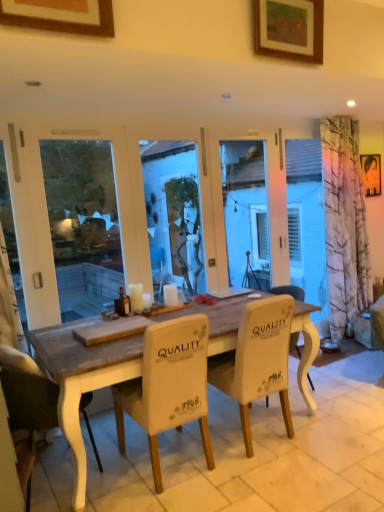
Question: From a real-world perspective, is wooden picture frame at upper center, which is the 3th picture frame in back-to-front order, beneath white fabric chair at center, the third chair viewed from the left?

Choices:
 (A) yes
 (B) no

Answer: (B)

Question: Is white fabric chair at center, the third chair viewed from the left, inside wooden picture frame at upper center, which is the 3th picture frame in back-to-front order?

Choices:
 (A) no
 (B) yes

Answer: (A)

Question: Considering the relative positions of wooden picture frame at upper center, which is the 3th picture frame in back-to-front order, and white fabric chair at center, the third chair viewed from the left, in the image provided, is wooden picture frame at upper center, which is the 3th picture frame in back-to-front order, behind white fabric chair at center, the third chair viewed from the left,?

Choices:
 (A) yes
 (B) no

Answer: (B)

Question: Considering the relative positions of wooden picture frame at upper center, which is counted as the third picture frame, starting from the right, and white fabric chair at center, the third chair viewed from the left, in the image provided, is wooden picture frame at upper center, which is counted as the third picture frame, starting from the right, to the right of white fabric chair at center, the third chair viewed from the left, from the viewer's perspective?

Choices:
 (A) yes
 (B) no

Answer: (B)

Question: From a real-world perspective, is wooden picture frame at upper center, which ranks as the first picture frame in front-to-back order, over white fabric chair at center, which is the first chair in right-to-left order?

Choices:
 (A) no
 (B) yes

Answer: (B)

Question: Is wooden picture frame at upper center, which is counted as the third picture frame, starting from the right, bigger than white fabric chair at center, the third chair viewed from the left?

Choices:
 (A) yes
 (B) no

Answer: (B)

Question: Does white wood desk at center have a smaller size compared to white wax candle at center, arranged as the 1th candle when viewed from the left?

Choices:
 (A) no
 (B) yes

Answer: (A)

Question: From the image's perspective, is white wood desk at center under white wax candle at center, the second candle viewed from the right?

Choices:
 (A) yes
 (B) no

Answer: (A)

Question: Can you confirm if white wood desk at center is bigger than white wax candle at center, arranged as the 1th candle when viewed from the left?

Choices:
 (A) no
 (B) yes

Answer: (B)

Question: Does white wood desk at center come behind white wax candle at center, arranged as the 1th candle when viewed from the left?

Choices:
 (A) yes
 (B) no

Answer: (B)

Question: Could you tell me if white wood desk at center is turned towards white wax candle at center, arranged as the 1th candle when viewed from the left?

Choices:
 (A) no
 (B) yes

Answer: (A)

Question: Is white wood desk at center wider than white wax candle at center, arranged as the 1th candle when viewed from the left?

Choices:
 (A) yes
 (B) no

Answer: (A)

Question: Is white fabric chair at center, the 2th chair when ordered from right to left, far from metallic silver portrait at upper right, the 3th picture frame viewed from the left?

Choices:
 (A) yes
 (B) no

Answer: (A)